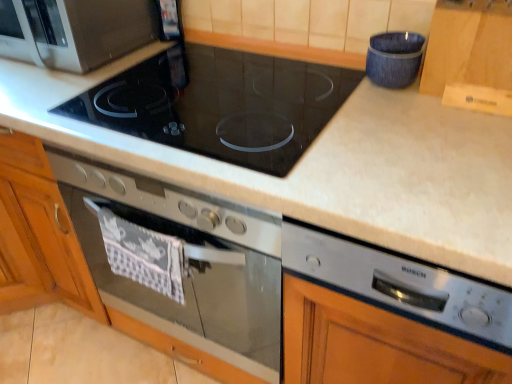
Find the location of a particular element. free space in front of matte black microwave at upper left is located at coordinates (67, 97).